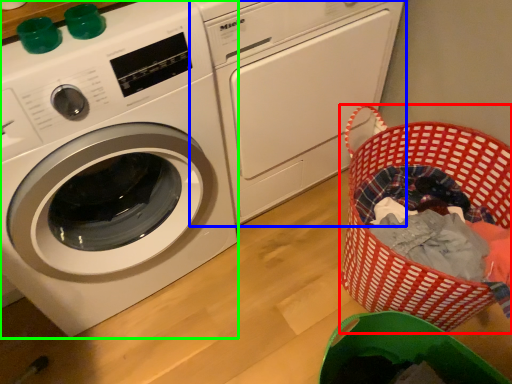
Question: Which object is the closest to the basket (highlighted by a red box)? Choose among these: washing machine (highlighted by a blue box) or washing machine (highlighted by a green box).

Choices:
 (A) washing machine
 (B) washing machine

Answer: (A)